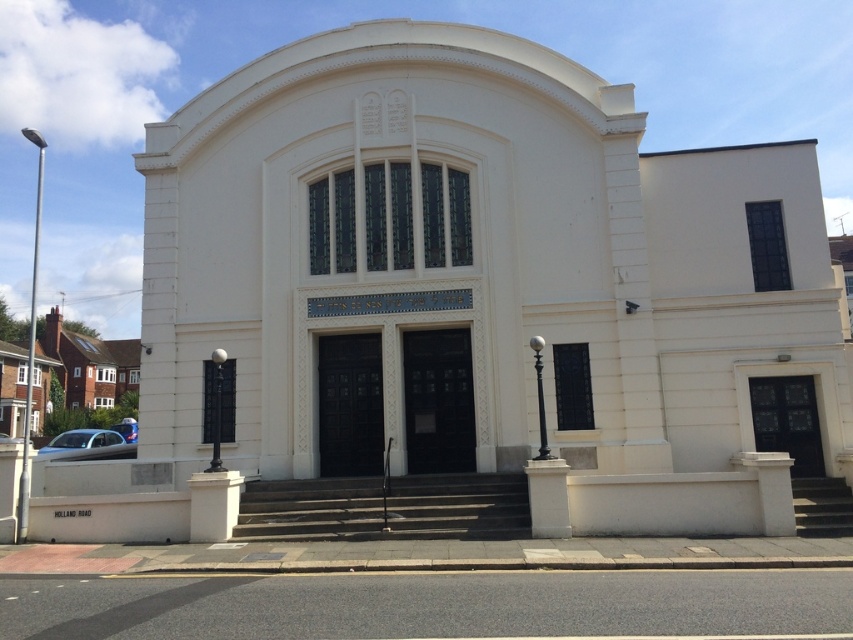
Question: Which of these objects is positioned farthest from the slate blue metallic car at lower left?

Choices:
 (A) concrete stairs at lower right
 (B) dark gray concrete stairs at center

Answer: (A)

Question: Among these points, which one is nearest to the camera?

Choices:
 (A) (508, 221)
 (B) (97, 442)
 (C) (136, 426)
 (D) (374, 513)

Answer: (D)

Question: Where is white smooth chapel at center located in relation to slate blue metallic car at lower left in the image?

Choices:
 (A) above
 (B) below

Answer: (A)

Question: Can you confirm if dark gray concrete stairs at center is smaller than concrete stairs at lower right?

Choices:
 (A) yes
 (B) no

Answer: (B)

Question: Is the position of white smooth chapel at center less distant than that of slate blue metallic car at lower left?

Choices:
 (A) no
 (B) yes

Answer: (B)

Question: Which object is closer to the camera taking this photo?

Choices:
 (A) slate blue metallic car at lower left
 (B) concrete stairs at lower right

Answer: (B)